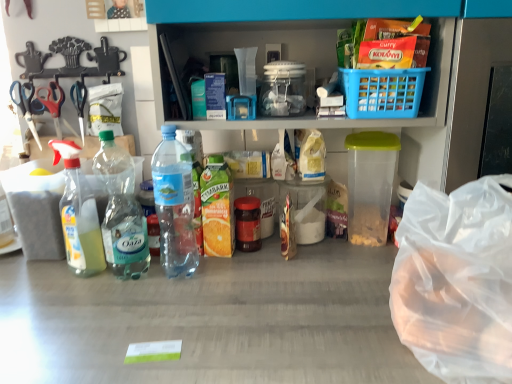
Question: Is red plastic scissors at left, placed as the 2th scissors when sorted from left to right, oriented towards transparent plastic bag at lower right?

Choices:
 (A) yes
 (B) no

Answer: (B)

Question: Considering the relative sizes of red plastic scissors at left, placed as the 2th scissors when sorted from left to right, and transparent plastic bag at lower right in the image provided, is red plastic scissors at left, placed as the 2th scissors when sorted from left to right, bigger than transparent plastic bag at lower right?

Choices:
 (A) no
 (B) yes

Answer: (A)

Question: Is red plastic scissors at left, which is the 2th scissors from right to left, looking in the opposite direction of transparent plastic bag at lower right?

Choices:
 (A) yes
 (B) no

Answer: (B)

Question: Can you confirm if red plastic scissors at left, which is the 2th scissors from right to left, is thinner than transparent plastic bag at lower right?

Choices:
 (A) no
 (B) yes

Answer: (B)

Question: From the image's perspective, is red plastic scissors at left, which is the 2th scissors from right to left, beneath transparent plastic bag at lower right?

Choices:
 (A) no
 (B) yes

Answer: (A)

Question: From the image's perspective, is clear plastic spray bottle at left, the 1th bottle in the left-to-right sequence, positioned above or below silver metallic scissors at left, positioned as the first scissors in right-to-left order?

Choices:
 (A) below
 (B) above

Answer: (A)

Question: Considering the positions of point (75, 263) and point (76, 84), is point (75, 263) closer or farther from the camera than point (76, 84)?

Choices:
 (A) closer
 (B) farther

Answer: (A)

Question: Looking at their shapes, would you say clear plastic spray bottle at left, acting as the 3th bottle starting from the right, is wider or thinner than silver metallic scissors at left, positioned as the first scissors in right-to-left order?

Choices:
 (A) thin
 (B) wide

Answer: (B)

Question: Would you say clear plastic spray bottle at left, the 1th bottle in the left-to-right sequence, is to the left or to the right of silver metallic scissors at left, positioned as the first scissors in right-to-left order, in the picture?

Choices:
 (A) left
 (B) right

Answer: (B)

Question: From the image's perspective, relative to clear plastic bottle at left, positioned as the second bottle in left-to-right order, is metallic scissors at left, the 3th scissors in the right-to-left sequence, above or below?

Choices:
 (A) below
 (B) above

Answer: (B)

Question: Is metallic scissors at left, acting as the first scissors starting from the left, in front of or behind clear plastic bottle at left, positioned as the second bottle in left-to-right order, in the image?

Choices:
 (A) front
 (B) behind

Answer: (B)

Question: Would you say metallic scissors at left, acting as the first scissors starting from the left, is inside or outside clear plastic bottle at left, which is the second bottle from right to left?

Choices:
 (A) outside
 (B) inside

Answer: (A)

Question: Considering the positions of metallic scissors at left, acting as the first scissors starting from the left, and clear plastic bottle at left, positioned as the second bottle in left-to-right order, in the image, is metallic scissors at left, acting as the first scissors starting from the left, taller or shorter than clear plastic bottle at left, positioned as the second bottle in left-to-right order,?

Choices:
 (A) short
 (B) tall

Answer: (A)

Question: In the image, is clear plastic spray bottle at left, the 1th bottle in the left-to-right sequence, on the left side or the right side of red plastic scissors at left, placed as the 2th scissors when sorted from left to right?

Choices:
 (A) left
 (B) right

Answer: (B)

Question: In terms of size, does clear plastic spray bottle at left, the 1th bottle in the left-to-right sequence, appear bigger or smaller than red plastic scissors at left, placed as the 2th scissors when sorted from left to right?

Choices:
 (A) big
 (B) small

Answer: (A)